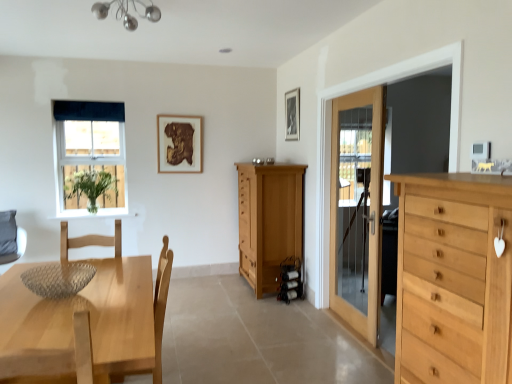
Where is `light brown wooden door at right`? This screenshot has width=512, height=384. light brown wooden door at right is located at coordinates (357, 207).

Locate an element on the screen. Image resolution: width=512 pixels, height=384 pixels. light wood chair at lower left is located at coordinates (156, 314).

The width and height of the screenshot is (512, 384). Identify the location of light brown wooden door at right. (357, 207).

From a real-world perspective, is gray fabric swivel chair at lower left above or below light wood chair at lower left?

From a real-world perspective, gray fabric swivel chair at lower left is physically above light wood chair at lower left.

Is there a large distance between gray fabric swivel chair at lower left and light wood chair at lower left?

gray fabric swivel chair at lower left is positioned a significant distance from light wood chair at lower left.

Can you confirm if gray fabric swivel chair at lower left is wider than light wood chair at lower left?

Yes, gray fabric swivel chair at lower left is wider than light wood chair at lower left.

Based on the photo, considering the relative sizes of gray fabric swivel chair at lower left and light wood chair at lower left in the image provided, is gray fabric swivel chair at lower left smaller than light wood chair at lower left?

Yes.

Considering the sizes of objects black matte picture frame at upper center, the second picture frame viewed from the back, and light brown wooden table at lower left in the image provided, who is bigger, black matte picture frame at upper center, the second picture frame viewed from the back, or light brown wooden table at lower left?

Bigger between the two is light brown wooden table at lower left.

The image size is (512, 384). I want to click on the 2nd picture frame counting from the right of the light brown wooden table at lower left, so click(x=292, y=115).

Is black matte picture frame at upper center, the second picture frame viewed from the back, with light brown wooden table at lower left?

No, black matte picture frame at upper center, the second picture frame viewed from the back, is not beside light brown wooden table at lower left.

Is black matte picture frame at upper center, positioned as the 1th picture frame in front-to-back order, to the right of light brown wooden table at lower left from the viewer's perspective?

Yes, black matte picture frame at upper center, positioned as the 1th picture frame in front-to-back order, is to the right of light brown wooden table at lower left.

In the scene shown: Could you tell me if dark blue fabric at upper left is turned towards natural wood cabinet at center, the 2th chest of drawers viewed from the front?

No, dark blue fabric at upper left is not aimed at natural wood cabinet at center, the 2th chest of drawers viewed from the front.

Could you measure the distance between dark blue fabric at upper left and natural wood cabinet at center, which appears as the 1th chest of drawers when viewed from the left?

dark blue fabric at upper left is 2.27 meters away from natural wood cabinet at center, which appears as the 1th chest of drawers when viewed from the left.

Which object is further away from the camera taking this photo, dark blue fabric at upper left or natural wood cabinet at center, which ranks as the 2th chest of drawers in right-to-left order?

dark blue fabric at upper left is behind.

Is dark blue fabric at upper left in contact with natural wood cabinet at center, which appears as the 1th chest of drawers when viewed from the back?

No, dark blue fabric at upper left is not in contact with natural wood cabinet at center, which appears as the 1th chest of drawers when viewed from the back.

Which of these two, light wood chest of drawers at right, which ranks as the 1th chest of drawers in front-to-back order, or wooden frame at upper center, the first picture frame when ordered from back to front, is thinner?

wooden frame at upper center, the first picture frame when ordered from back to front.

From the picture: Which object is closer to the camera, light wood chest of drawers at right, which ranks as the 1th chest of drawers in front-to-back order, or wooden frame at upper center, which appears as the second picture frame when viewed from the right?

light wood chest of drawers at right, which ranks as the 1th chest of drawers in front-to-back order, is closer to the camera.

From a real-world perspective, is light wood chest of drawers at right, placed as the 2th chest of drawers when sorted from back to front, positioned under wooden frame at upper center, the 2th picture frame when ordered from front to back, based on gravity?

Yes.

Is light wood chest of drawers at right, acting as the 1th chest of drawers starting from the right, next to wooden frame at upper center, which appears as the second picture frame when viewed from the right?

No, light wood chest of drawers at right, acting as the 1th chest of drawers starting from the right, is not with wooden frame at upper center, which appears as the second picture frame when viewed from the right.

Is light brown wooden door at right taller or shorter than dark blue fabric at upper left?

In the image, light brown wooden door at right appears to be taller than dark blue fabric at upper left.

Image resolution: width=512 pixels, height=384 pixels. What are the coordinates of `door that is in front of the dark blue fabric at upper left` in the screenshot? It's located at click(x=357, y=207).

Considering the sizes of objects light brown wooden door at right and dark blue fabric at upper left in the image provided, who is smaller, light brown wooden door at right or dark blue fabric at upper left?

With smaller size is dark blue fabric at upper left.

Which is behind, point (331, 285) or point (110, 108)?

The point (110, 108) is more distant.

From a real-world perspective, is natural wood cabinet at center, the 2th chest of drawers viewed from the front, under light wood chest of drawers at right, which ranks as the 1th chest of drawers in front-to-back order?

Yes.

Is natural wood cabinet at center, which appears as the 1th chest of drawers when viewed from the left, next to light wood chest of drawers at right, acting as the 1th chest of drawers starting from the right, and touching it?

No, natural wood cabinet at center, which appears as the 1th chest of drawers when viewed from the left, is not next to light wood chest of drawers at right, acting as the 1th chest of drawers starting from the right.

Who is taller, green matte vase at left or matte glass window at upper left?

matte glass window at upper left.

Is point (114, 169) less distant than point (89, 167)?

That is False.

Between green matte vase at left and matte glass window at upper left, which one has smaller size?

matte glass window at upper left.

Identify the location of swivel chair that is above the light wood chair at lower left (from the image's perspective). (11, 238).

Starting from the light brown wooden table at lower left, which picture frame is the 2nd one to the right? Please provide its 2D coordinates.

[(292, 115)]

When comparing their distances from natural wood cabinet at center, which ranks as the 2th chest of drawers in right-to-left order, does light wood chest of drawers at right, placed as the 2th chest of drawers when sorted from back to front, or matte glass window at upper left seem closer?

matte glass window at upper left is closer to natural wood cabinet at center, which ranks as the 2th chest of drawers in right-to-left order.

Which object lies further to the anchor point light wood chest of drawers at right, the second chest of drawers when ordered from left to right, light brown wooden door at right or light wood chair at lower left?

light brown wooden door at right is further to light wood chest of drawers at right, the second chest of drawers when ordered from left to right.

In the scene shown: Looking at the image, which one is located closer to light brown wooden table at lower left, light brown wooden door at right or metallic glass chandelier at upper center?

metallic glass chandelier at upper center lies closer to light brown wooden table at lower left than the other object.

Estimate the real-world distances between objects in this image. Which object is further from light wood chair at lower left, gray fabric swivel chair at lower left or black matte picture frame at upper center, arranged as the second picture frame when viewed from the left?

Based on the image, gray fabric swivel chair at lower left appears to be further to light wood chair at lower left.

When comparing their distances from light brown wooden table at lower left, does light brown wooden door at right or wooden frame at upper center, the 2th picture frame when ordered from front to back, seem closer?

Among the two, light brown wooden door at right is located nearer to light brown wooden table at lower left.

Which object lies further to the anchor point light brown wooden door at right, light brown wooden table at lower left or metallic glass chandelier at upper center?

metallic glass chandelier at upper center is positioned further to the anchor light brown wooden door at right.

Which object lies nearer to the anchor point light wood chair at lower left, light brown wooden door at right or green matte vase at left?

light brown wooden door at right is closer to light wood chair at lower left.

Which object lies nearer to the anchor point green matte vase at left, gray fabric swivel chair at lower left or wooden frame at upper center, the 2th picture frame when ordered from front to back?

wooden frame at upper center, the 2th picture frame when ordered from front to back, is closer to green matte vase at left.

Where is `chair between light wood chest of drawers at right, which ranks as the 1th chest of drawers in front-to-back order, and green matte vase at left, along the z-axis`? chair between light wood chest of drawers at right, which ranks as the 1th chest of drawers in front-to-back order, and green matte vase at left, along the z-axis is located at coordinates (156, 314).

Locate an element on the screen. picture frame between metallic glass chandelier at upper center and dark blue fabric at upper left from front to back is located at coordinates (292, 115).

Identify the location of swivel chair between light wood chair at lower left and dark blue fabric at upper left in the front-back direction. [11, 238].

Find the location of a particular element. This screenshot has width=512, height=384. curtain located between metallic glass chandelier at upper center and wooden frame at upper center, the 2th picture frame when ordered from front to back, in the depth direction is located at coordinates (89, 111).